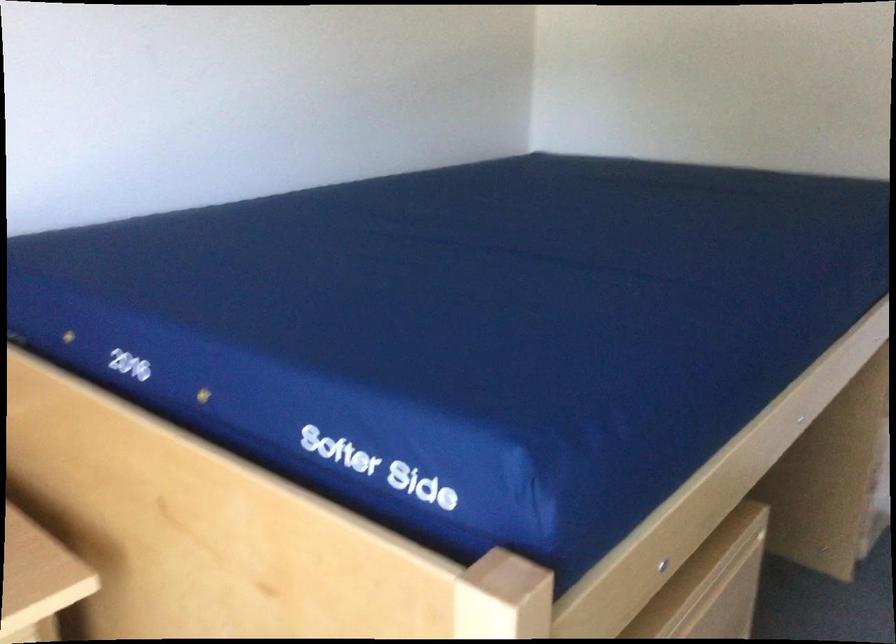
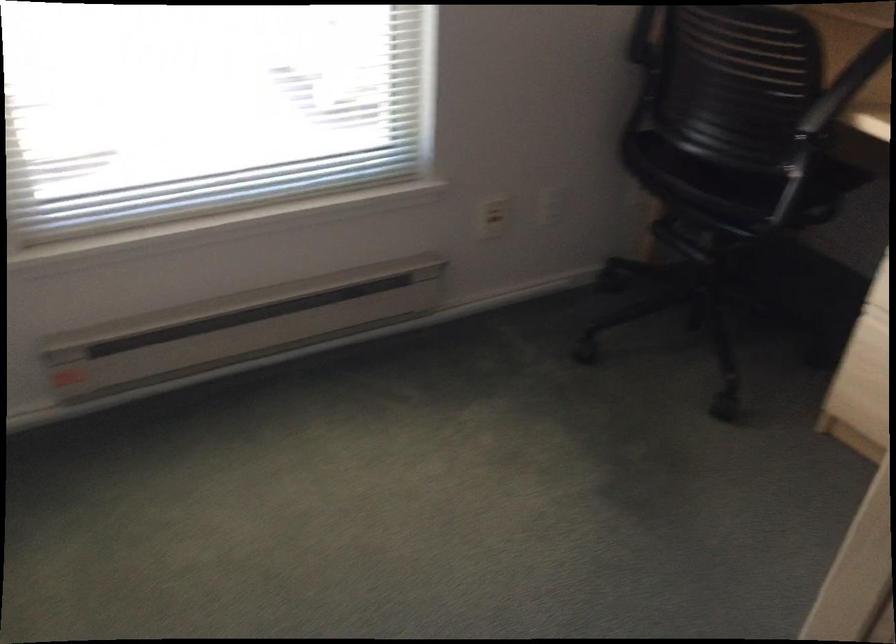
How did the camera likely rotate?

The camera rotated toward left-down.